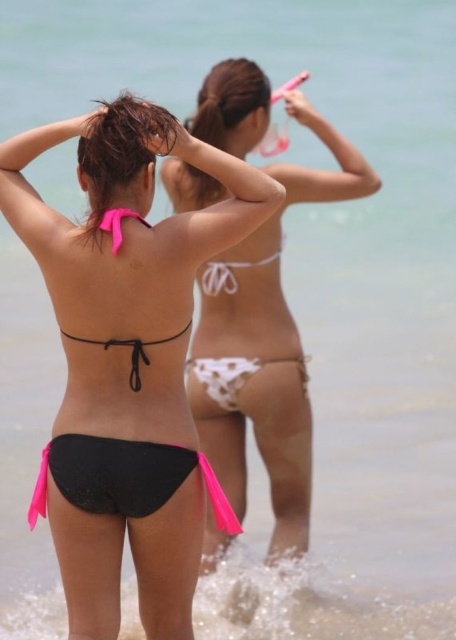
Question: Estimate the real-world distances between objects in this image. Which object is closer to the pink satin bikini top at upper center?

Choices:
 (A) white polka dot bikini at center
 (B) white matte bikini bottom at center

Answer: (B)

Question: Does white polka dot bikini at center have a greater width compared to pink satin bikini top at upper center?

Choices:
 (A) no
 (B) yes

Answer: (B)

Question: Is white matte bikini bottom at center smaller than pink satin bikini top at upper center?

Choices:
 (A) yes
 (B) no

Answer: (B)

Question: Which object is the closest to the white matte bikini bottom at center?

Choices:
 (A) pink satin bikini top at upper center
 (B) white polka dot bikini at center

Answer: (B)

Question: Considering the real-world distances, which object is closest to the pink satin bikini top at upper center?

Choices:
 (A) white polka dot bikini at center
 (B) white matte bikini bottom at center

Answer: (B)

Question: Does white polka dot bikini at center lie behind pink satin bikini top at upper center?

Choices:
 (A) no
 (B) yes

Answer: (B)